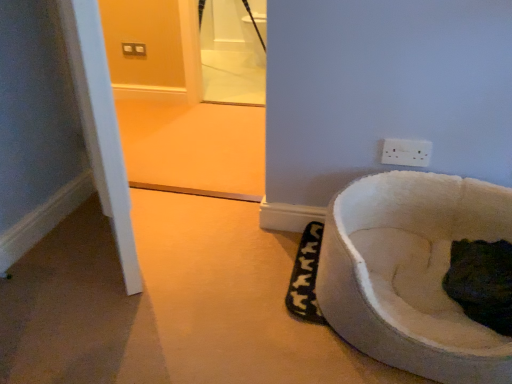
Image resolution: width=512 pixels, height=384 pixels. I want to click on dark fur cat at lower right, so click(x=482, y=282).

The height and width of the screenshot is (384, 512). Find the location of `white plastic power plugs and sockets at upper right`. white plastic power plugs and sockets at upper right is located at coordinates (406, 152).

Would you say dark fur cat at lower right is a long distance from white soft pet bed at lower right?

That's not correct — dark fur cat at lower right is a little close to white soft pet bed at lower right.

Is dark fur cat at lower right further to camera compared to white soft pet bed at lower right?

Yes, dark fur cat at lower right is behind white soft pet bed at lower right.

From the image's perspective, which one is positioned lower, dark fur cat at lower right or white soft pet bed at lower right?

dark fur cat at lower right.

Is dark fur cat at lower right located outside white soft pet bed at lower right?

Actually, dark fur cat at lower right is within white soft pet bed at lower right.

From the image's perspective, is white soft pet bed at lower right located above or below dark fur cat at lower right?

white soft pet bed at lower right is situated higher than dark fur cat at lower right in the image.

Does white soft pet bed at lower right turn towards dark fur cat at lower right?

Yes, white soft pet bed at lower right faces towards dark fur cat at lower right.

Considering the sizes of white soft pet bed at lower right and dark fur cat at lower right in the image, is white soft pet bed at lower right bigger or smaller than dark fur cat at lower right?

white soft pet bed at lower right is bigger than dark fur cat at lower right.

Looking at their sizes, would you say white soft pet bed at lower right is wider or thinner than dark fur cat at lower right?

In the image, white soft pet bed at lower right appears to be wider than dark fur cat at lower right.

From a real-world perspective, who is located higher, white plastic power plugs and sockets at upper right or dark fur cat at lower right?

white plastic power plugs and sockets at upper right, from a real-world perspective.

Is point (414, 146) farther from camera compared to point (505, 312)?

Yes, point (414, 146) is farther from viewer.

How far apart are white plastic power plugs and sockets at upper right and dark fur cat at lower right?

white plastic power plugs and sockets at upper right is 39.05 centimeters away from dark fur cat at lower right.

Considering the relative sizes of white plastic power plugs and sockets at upper right and dark fur cat at lower right in the image provided, is white plastic power plugs and sockets at upper right taller than dark fur cat at lower right?

Incorrect, the height of white plastic power plugs and sockets at upper right is not larger of that of dark fur cat at lower right.

Which of these two, white soft pet bed at lower right or white plastic power plugs and sockets at upper right, is smaller?

white plastic power plugs and sockets at upper right is smaller.

Does white soft pet bed at lower right come in front of white plastic power plugs and sockets at upper right?

Yes, white soft pet bed at lower right is closer to the camera.

Could you tell me if white soft pet bed at lower right is facing white plastic power plugs and sockets at upper right?

No, white soft pet bed at lower right is not aimed at white plastic power plugs and sockets at upper right.

In terms of height, does white soft pet bed at lower right look taller or shorter compared to white plastic power plugs and sockets at upper right?

white soft pet bed at lower right is taller than white plastic power plugs and sockets at upper right.

Considering their positions, is dark fur cat at lower right located in front of or behind white plastic power plugs and sockets at upper right?

dark fur cat at lower right is positioned closer to the viewer than white plastic power plugs and sockets at upper right.

Is dark fur cat at lower right bigger or smaller than white plastic power plugs and sockets at upper right?

dark fur cat at lower right is bigger than white plastic power plugs and sockets at upper right.

Does dark fur cat at lower right have a greater height compared to white plastic power plugs and sockets at upper right?

Indeed, dark fur cat at lower right has a greater height compared to white plastic power plugs and sockets at upper right.

The height and width of the screenshot is (384, 512). In order to click on power plugs and sockets on the left of dark fur cat at lower right in this screenshot , I will do `click(406, 152)`.

From a real-world perspective, is white plastic power plugs and sockets at upper right above or below white soft pet bed at lower right?

white plastic power plugs and sockets at upper right is above white soft pet bed at lower right.

Is the position of white plastic power plugs and sockets at upper right more distant than that of white soft pet bed at lower right?

Yes, the depth of white plastic power plugs and sockets at upper right is greater than that of white soft pet bed at lower right.

Considering the points (428, 152) and (452, 222), which point is behind, point (428, 152) or point (452, 222)?

The point (452, 222) is farther from the camera.

Which is more to the right, white plastic power plugs and sockets at upper right or white soft pet bed at lower right?

From the viewer's perspective, white soft pet bed at lower right appears more on the right side.

Where is `toilet above the dark fur cat at lower right (from a real-world perspective)`? The image size is (512, 384). toilet above the dark fur cat at lower right (from a real-world perspective) is located at coordinates (411, 273).

You are a GUI agent. You are given a task and a screenshot of the screen. Output one action in this format:
    pyautogui.click(x=<x>, y=<y>)
    Task: Click on the cat lying on the right of white soft pet bed at lower right
    Image resolution: width=512 pixels, height=384 pixels.
    Given the screenshot: What is the action you would take?
    pyautogui.click(x=482, y=282)

Estimate the real-world distances between objects in this image. Which object is closer to white soft pet bed at lower right, white plastic power plugs and sockets at upper right or dark fur cat at lower right?

Among the two, dark fur cat at lower right is located nearer to white soft pet bed at lower right.

Based on their spatial positions, is white soft pet bed at lower right or white plastic power plugs and sockets at upper right further from dark fur cat at lower right?

white plastic power plugs and sockets at upper right is further to dark fur cat at lower right.

Based on their spatial positions, is dark fur cat at lower right or white plastic power plugs and sockets at upper right further from white soft pet bed at lower right?

white plastic power plugs and sockets at upper right is positioned further to the anchor white soft pet bed at lower right.

Which object lies further to the anchor point white plastic power plugs and sockets at upper right, white soft pet bed at lower right or dark fur cat at lower right?

dark fur cat at lower right lies further to white plastic power plugs and sockets at upper right than the other object.

From the picture: Estimate the real-world distances between objects in this image. Which object is closer to white plastic power plugs and sockets at upper right, dark fur cat at lower right or white soft pet bed at lower right?

Based on the image, white soft pet bed at lower right appears to be nearer to white plastic power plugs and sockets at upper right.

When comparing their distances from dark fur cat at lower right, does white plastic power plugs and sockets at upper right or white soft pet bed at lower right seem further?

white plastic power plugs and sockets at upper right is positioned further to the anchor dark fur cat at lower right.

This screenshot has width=512, height=384. In order to click on cat located between white soft pet bed at lower right and white plastic power plugs and sockets at upper right in the depth direction in this screenshot , I will do `click(482, 282)`.